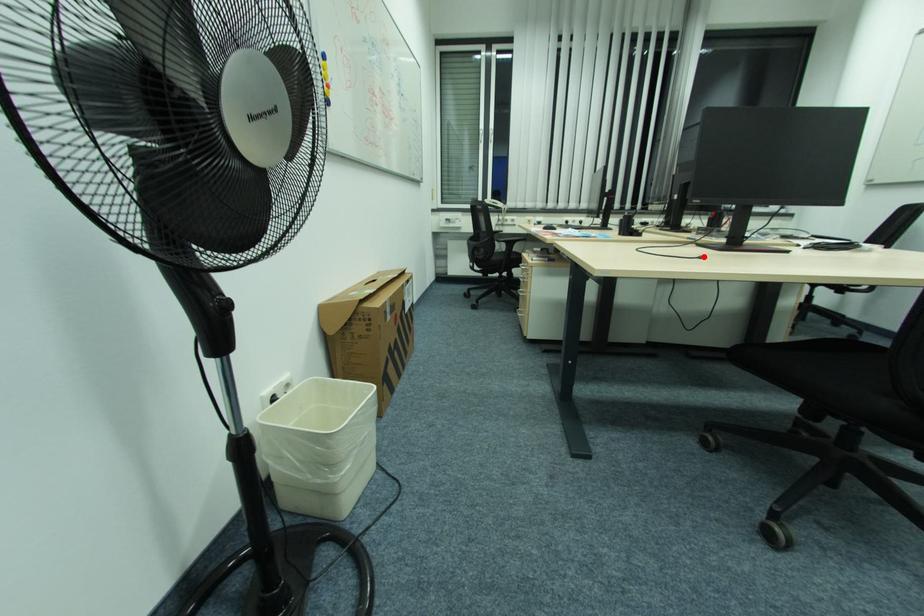
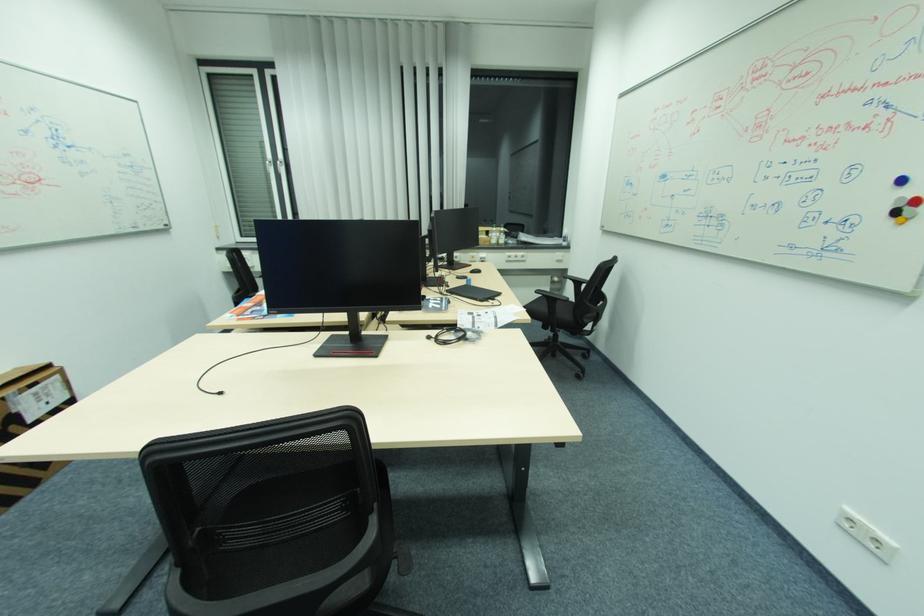
The point at the highlighted location is marked in the first image. Where is the corresponding point in the second image?

(223, 392)